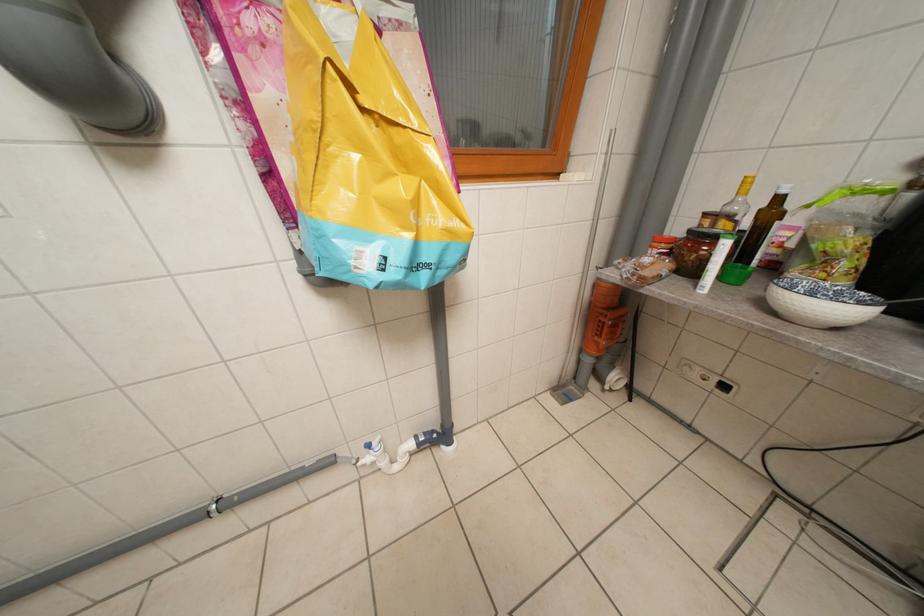
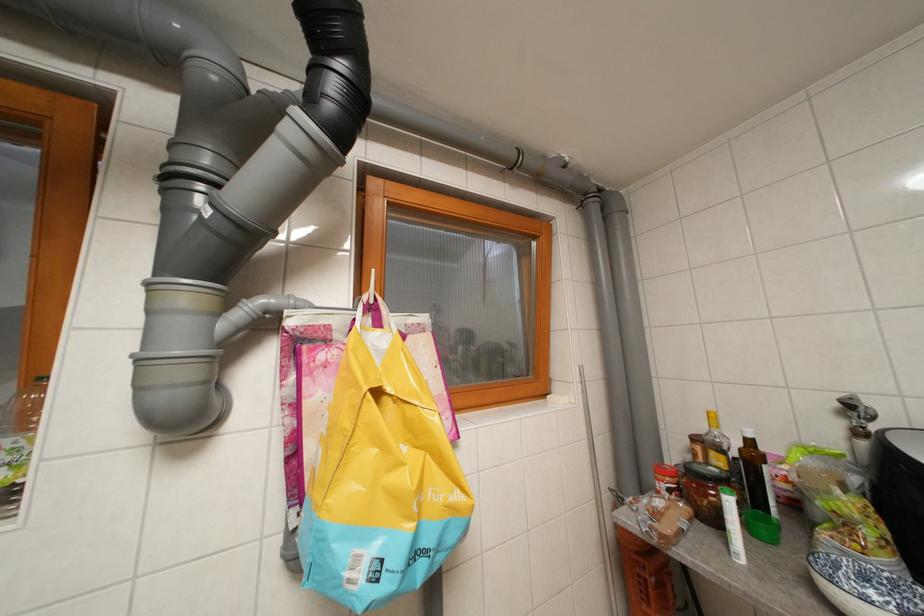
Question: Based on the continuous images, in which direction is the camera rotating? Reply with the corresponding letter.

Choices:
 (A) Left
 (B) Right
 (C) Up
 (D) Down

Answer: (C)